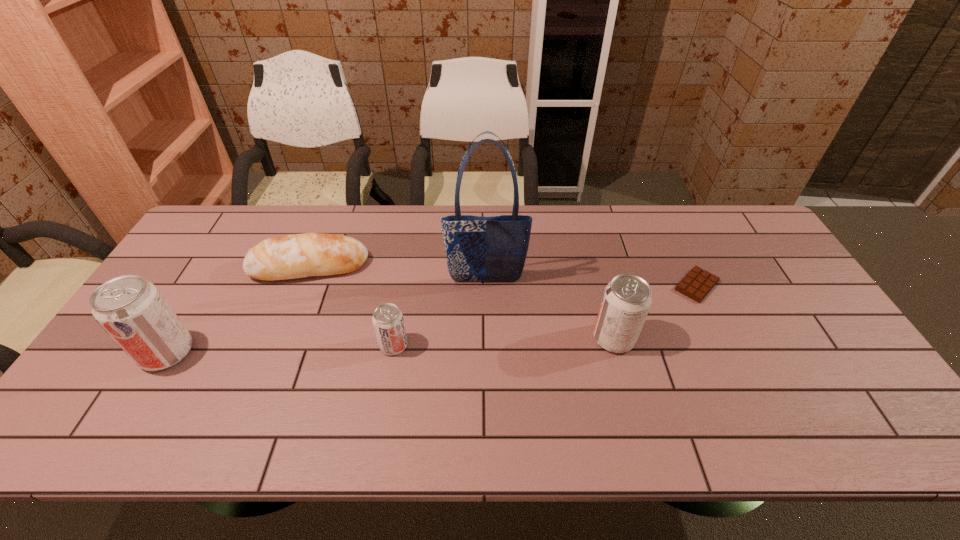
What are the coordinates of `the leftmost object` in the screenshot? It's located at (135, 314).

Where is `the shortest soda can`? The height and width of the screenshot is (540, 960). the shortest soda can is located at coordinates click(388, 323).

The height and width of the screenshot is (540, 960). I want to click on the second soda can from left to right, so click(388, 323).

Where is `the second tallest soda can`? Image resolution: width=960 pixels, height=540 pixels. the second tallest soda can is located at coordinates (627, 299).

Locate an element on the screen. The height and width of the screenshot is (540, 960). the fourth shortest object is located at coordinates (627, 299).

Identify the location of bread. (293, 256).

Locate an element on the screen. the second object from left to right is located at coordinates coord(293,256).

The image size is (960, 540). I want to click on the rightmost object, so click(x=696, y=285).

Where is `the shortest object`? This screenshot has height=540, width=960. the shortest object is located at coordinates (696, 285).

The width and height of the screenshot is (960, 540). I want to click on the tallest object, so click(x=478, y=248).